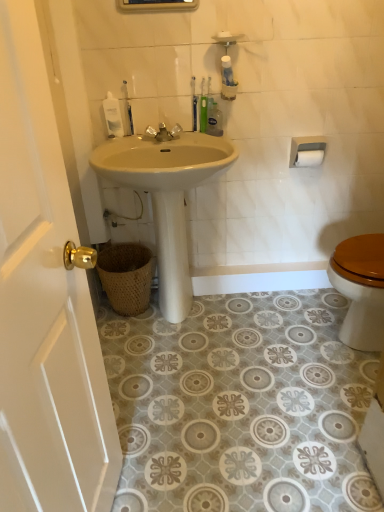
Question: Considering the relative sizes of woven brown basket at lower left and translucent plastic bottle at upper center, the third toiletry when ordered from left to right, in the image provided, is woven brown basket at lower left thinner than translucent plastic bottle at upper center, the third toiletry when ordered from left to right,?

Choices:
 (A) yes
 (B) no

Answer: (B)

Question: Does woven brown basket at lower left have a greater height compared to translucent plastic bottle at upper center, the third toiletry when ordered from left to right?

Choices:
 (A) yes
 (B) no

Answer: (A)

Question: Is the position of woven brown basket at lower left less distant than that of translucent plastic bottle at upper center, which is the first toiletry from right to left?

Choices:
 (A) yes
 (B) no

Answer: (B)

Question: Is woven brown basket at lower left shorter than translucent plastic bottle at upper center, which is the first toiletry from right to left?

Choices:
 (A) no
 (B) yes

Answer: (A)

Question: Is translucent plastic bottle at upper center, the third toiletry when ordered from left to right, located within woven brown basket at lower left?

Choices:
 (A) yes
 (B) no

Answer: (B)

Question: Is woven brown basket at lower left further to the viewer compared to translucent plastic bottle at upper center, which is the first toiletry from right to left?

Choices:
 (A) yes
 (B) no

Answer: (A)

Question: Is white glossy door at left a part of metallic faucet at center?

Choices:
 (A) yes
 (B) no

Answer: (B)

Question: Is metallic faucet at center directly adjacent to white glossy door at left?

Choices:
 (A) no
 (B) yes

Answer: (A)

Question: Considering the relative sizes of metallic faucet at center and white glossy door at left in the image provided, is metallic faucet at center taller than white glossy door at left?

Choices:
 (A) yes
 (B) no

Answer: (B)

Question: Does metallic faucet at center lie behind white glossy door at left?

Choices:
 (A) no
 (B) yes

Answer: (B)

Question: Is metallic faucet at center at the right side of white glossy door at left?

Choices:
 (A) yes
 (B) no

Answer: (A)

Question: Does metallic faucet at center have a smaller size compared to white glossy door at left?

Choices:
 (A) no
 (B) yes

Answer: (B)

Question: Can you confirm if white matte soap at upper center is smaller than white plastic toilet paper holder at upper right?

Choices:
 (A) no
 (B) yes

Answer: (B)